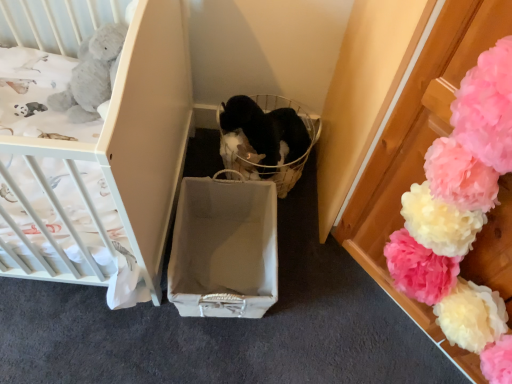
Question: Is black fabric basket at center oriented towards fluffy tissue paper pom-poms at right?

Choices:
 (A) no
 (B) yes

Answer: (A)

Question: Does black fabric basket at center have a greater width compared to fluffy tissue paper pom-poms at right?

Choices:
 (A) no
 (B) yes

Answer: (B)

Question: Is black fabric basket at center positioned before fluffy tissue paper pom-poms at right?

Choices:
 (A) yes
 (B) no

Answer: (B)

Question: Is fluffy tissue paper pom-poms at right inside black fabric basket at center?

Choices:
 (A) no
 (B) yes

Answer: (A)

Question: Is black fabric basket at center positioned with its back to fluffy tissue paper pom-poms at right?

Choices:
 (A) no
 (B) yes

Answer: (A)

Question: Is point (263, 192) positioned closer to the camera than point (242, 114)?

Choices:
 (A) closer
 (B) farther

Answer: (A)

Question: From a real-world perspective, relative to black fabric basket at center, is matte gray cardboard box at center vertically above or below?

Choices:
 (A) above
 (B) below

Answer: (B)

Question: Looking at the image, does matte gray cardboard box at center seem bigger or smaller compared to black fabric basket at center?

Choices:
 (A) small
 (B) big

Answer: (B)

Question: In the image, is matte gray cardboard box at center positioned in front of or behind black fabric basket at center?

Choices:
 (A) front
 (B) behind

Answer: (A)

Question: From the image's perspective, is black fabric basket at center located above or below matte white crib at left?

Choices:
 (A) below
 (B) above

Answer: (A)

Question: Considering the relative positions of black fabric basket at center and matte white crib at left in the image provided, is black fabric basket at center to the left or to the right of matte white crib at left?

Choices:
 (A) right
 (B) left

Answer: (A)

Question: In terms of width, does black fabric basket at center look wider or thinner when compared to matte white crib at left?

Choices:
 (A) wide
 (B) thin

Answer: (B)

Question: Do you think black fabric basket at center is within matte white crib at left, or outside of it?

Choices:
 (A) inside
 (B) outside

Answer: (B)

Question: From a real-world perspective, is fluffy tissue paper pom-poms at right positioned above or below matte gray cardboard box at center?

Choices:
 (A) above
 (B) below

Answer: (A)

Question: In terms of width, does fluffy tissue paper pom-poms at right look wider or thinner when compared to matte gray cardboard box at center?

Choices:
 (A) wide
 (B) thin

Answer: (B)